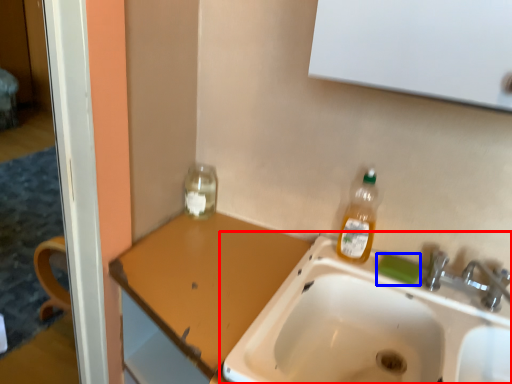
Question: Which point is closer to the camera, sink (highlighted by a red box) or soap (highlighted by a blue box)?

Choices:
 (A) sink
 (B) soap

Answer: (A)